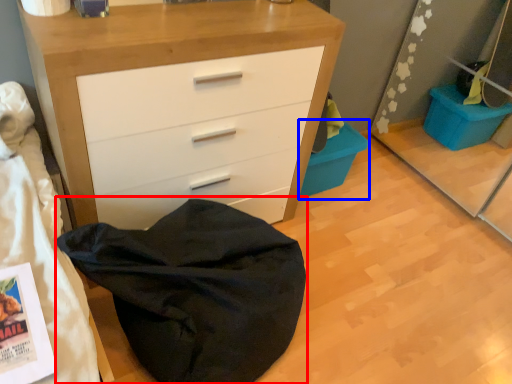
Question: Which object appears closest to the camera in this image, bean bag chair (highlighted by a red box) or cabinetry (highlighted by a blue box)?

Choices:
 (A) bean bag chair
 (B) cabinetry

Answer: (A)